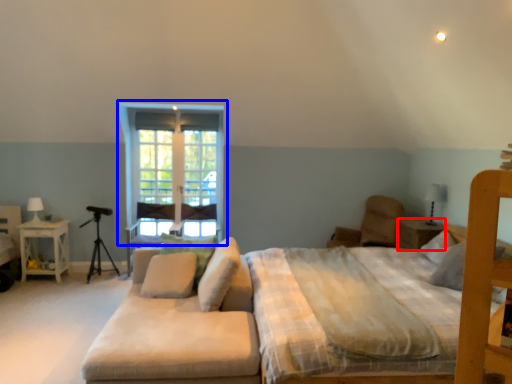
Question: Which point is closer to the camera, nightstand (highlighted by a red box) or window (highlighted by a blue box)?

Choices:
 (A) nightstand
 (B) window

Answer: (A)